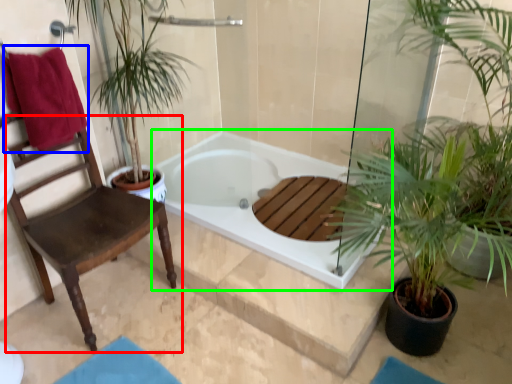
Question: Considering the real-world distances, which object is closest to chair (highlighted by a red box)? beach towel (highlighted by a blue box) or bathtub (highlighted by a green box).

Choices:
 (A) beach towel
 (B) bathtub

Answer: (A)